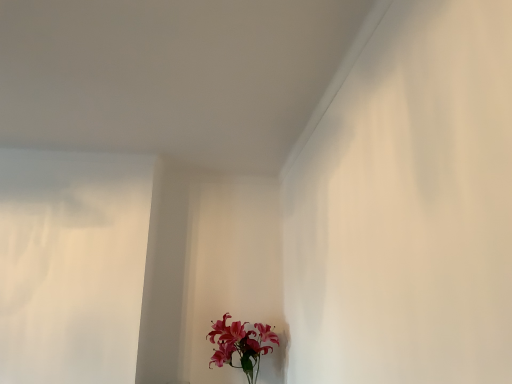
Describe the element at coordinates (241, 344) in the screenshot. This screenshot has width=512, height=384. I see `pink silk flowers at lower center` at that location.

Locate an element on the screen. The image size is (512, 384). pink silk flowers at lower center is located at coordinates (241, 344).

Image resolution: width=512 pixels, height=384 pixels. What are the coordinates of `pink silk flowers at lower center` in the screenshot? It's located at (241, 344).